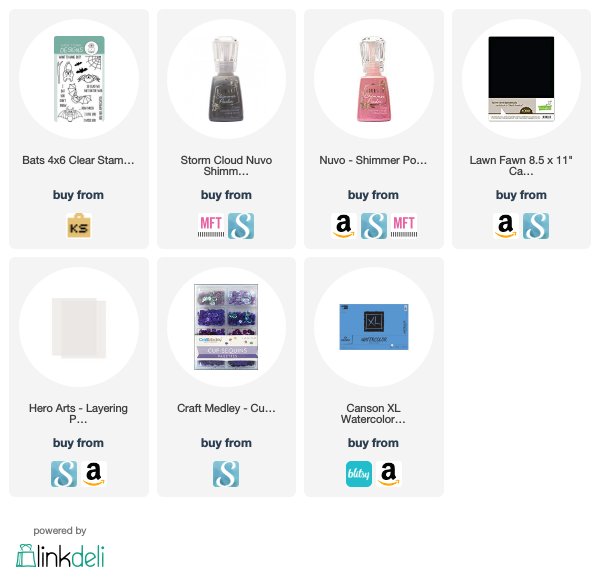
I want to click on stickers, so pyautogui.click(x=82, y=87).